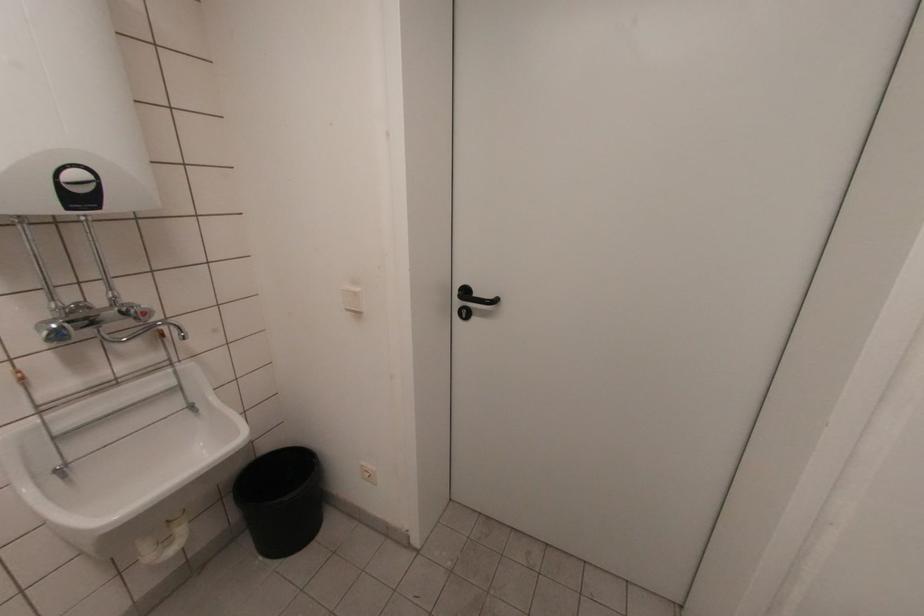
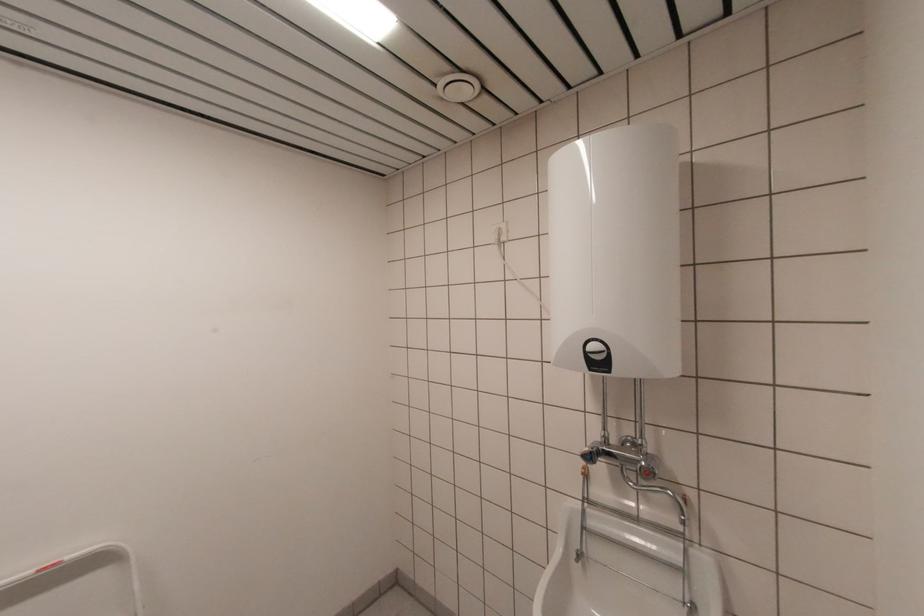
Where in the second image is the point corresponding to the point at 94,185 from the first image?

(605, 354)